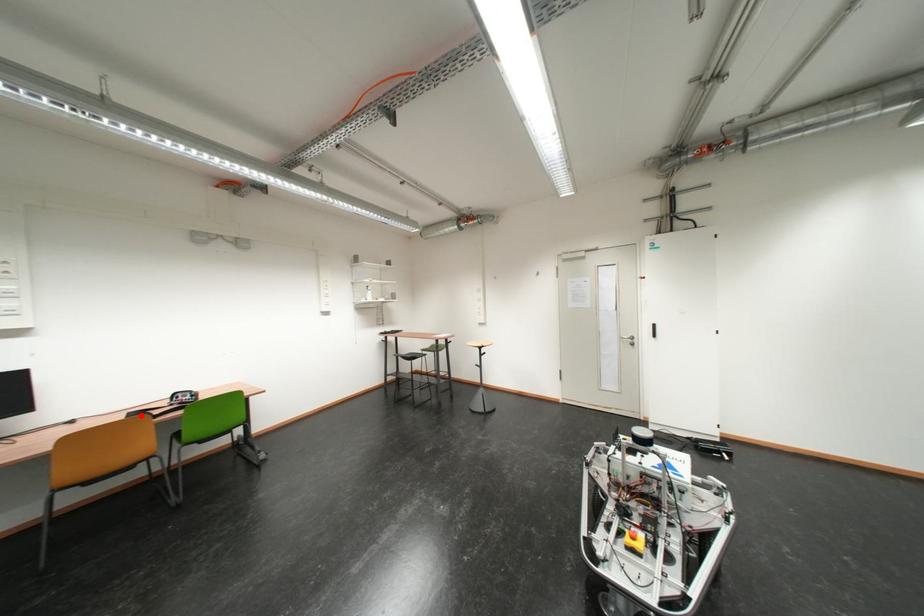
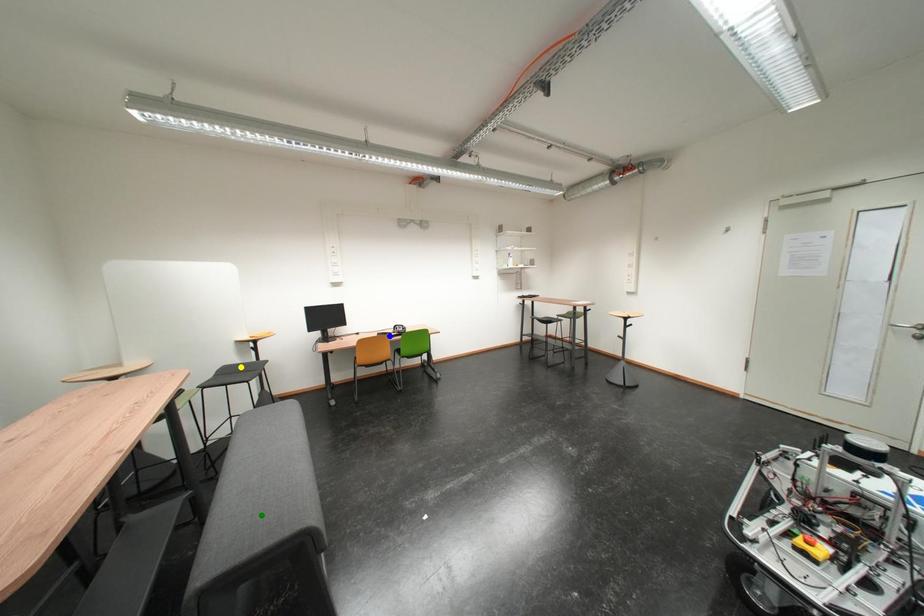
Question: I am providing you with two images of the same scene from different viewpoints. A red point is marked on the first image. You are given multiple points on the second image. Which spot in image 2 lines up with the point in image 1?

Choices:
 (A) green point
 (B) blue point
 (C) yellow point

Answer: (B)